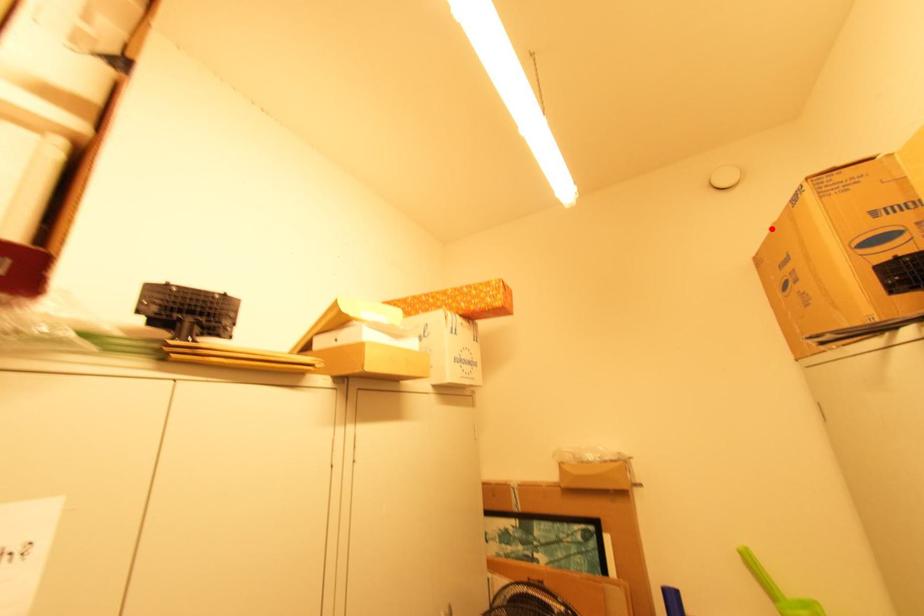
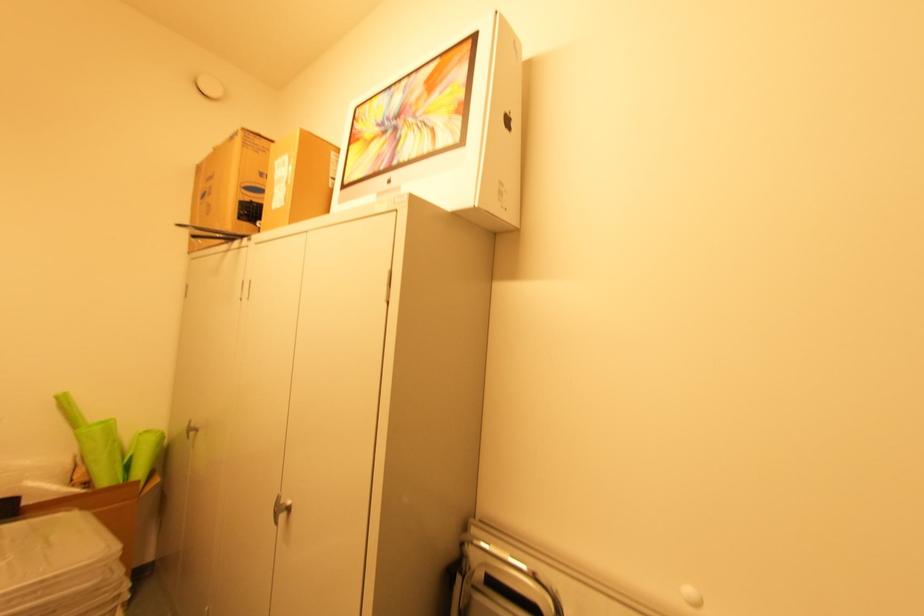
Locate, in the second image, the point that corresponds to the highlighted location in the first image.

(216, 148)